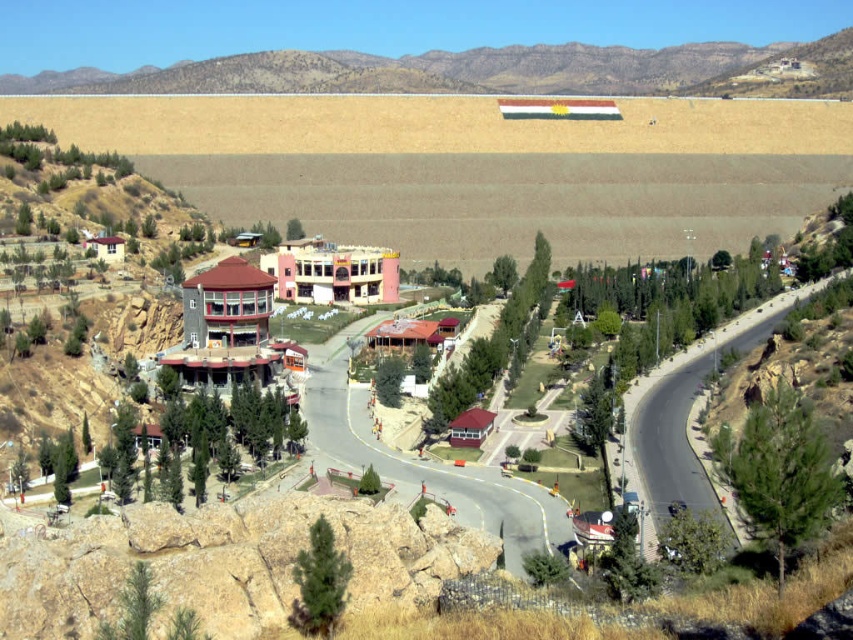
Which is below, brown rocky mountain at upper center or asphalt road at right?

asphalt road at right

Can you confirm if brown rocky mountain at upper center is shorter than asphalt road at right?

No.

Based on the photo, measure the distance between brown rocky mountain at upper center and camera.

419.02 meters

In order to click on brown rocky mountain at upper center in this screenshot , I will do `click(482, 72)`.